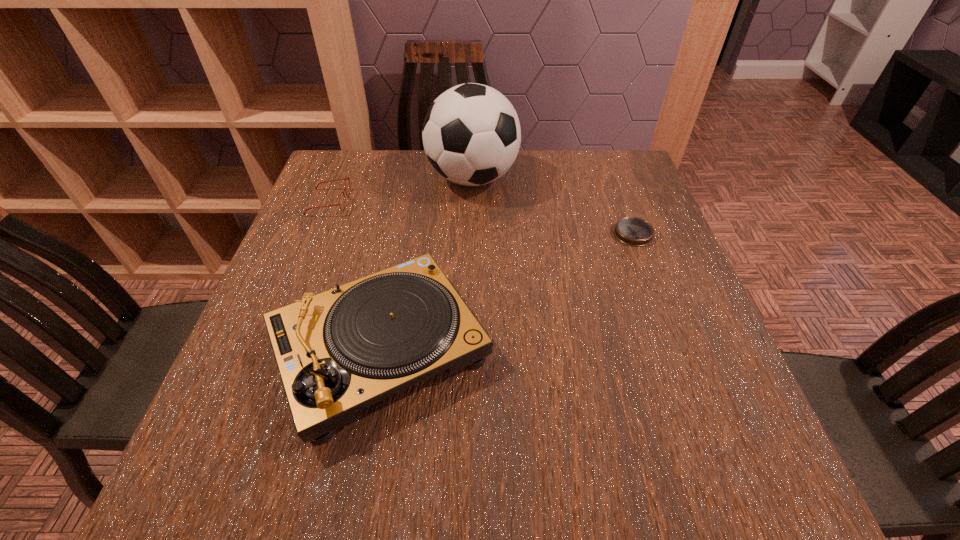
This screenshot has height=540, width=960. I want to click on soccer ball at the far edge, so click(x=471, y=134).

This screenshot has height=540, width=960. Identify the location of spectacles that is at the far edge. (347, 178).

Image resolution: width=960 pixels, height=540 pixels. Identify the location of object that is at the near edge. (338, 352).

Find the location of a particular element. The width and height of the screenshot is (960, 540). record player at the left edge is located at coordinates (338, 352).

Identify the location of spectacles present at the left edge. This screenshot has height=540, width=960. (347, 178).

In order to click on object present at the right edge in this screenshot , I will do `click(632, 231)`.

Where is `object that is at the far left corner`? This screenshot has height=540, width=960. object that is at the far left corner is located at coordinates (347, 178).

Locate an element on the screen. Image resolution: width=960 pixels, height=540 pixels. object that is positioned at the near left corner is located at coordinates (338, 352).

This screenshot has width=960, height=540. I want to click on free space at the far edge of the desktop, so click(x=427, y=164).

You are a GUI agent. You are given a task and a screenshot of the screen. Output one action in this format:
    pyautogui.click(x=<x>, y=<y>)
    Task: Click on the vacant area at the left edge
    
    Given the screenshot: What is the action you would take?
    pyautogui.click(x=293, y=242)